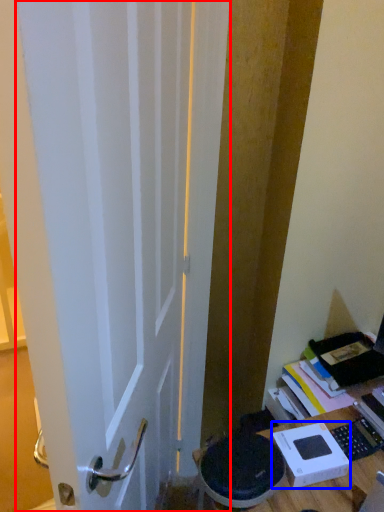
Question: Which of the following is the closest to the observer, door (highlighted by a red box) or cardboard box (highlighted by a blue box)?

Choices:
 (A) door
 (B) cardboard box

Answer: (A)